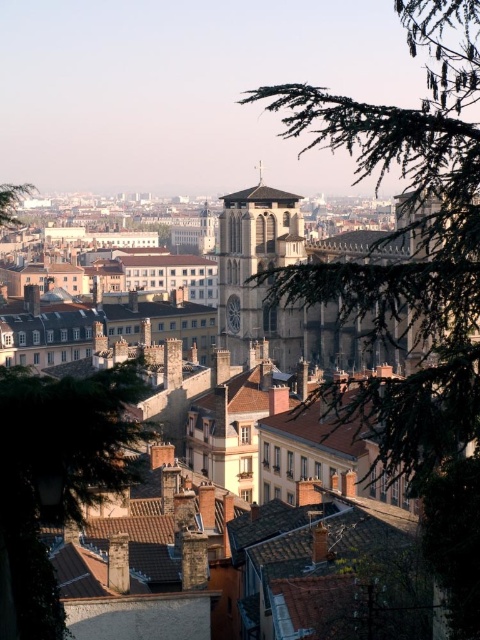
You are standing in the city park and see the stone church at center and the green leafy tree at lower left. Which object is positioned higher in the image?

The stone church at center is positioned higher than the green leafy tree at lower left according to the description.